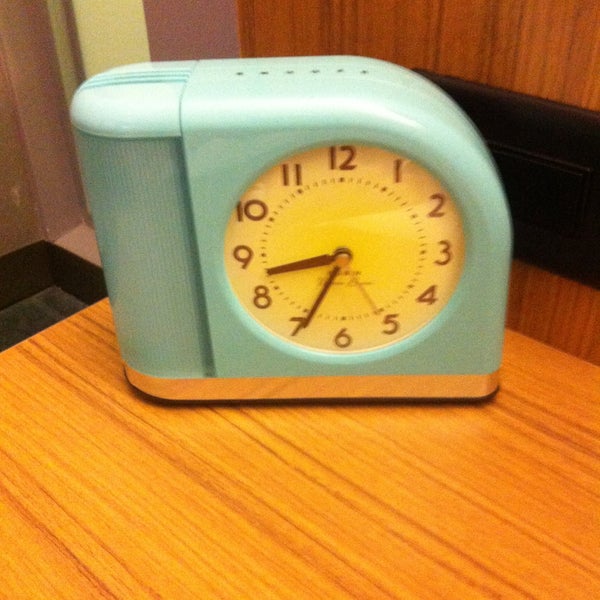
I want to click on clock frame, so click(247, 155).